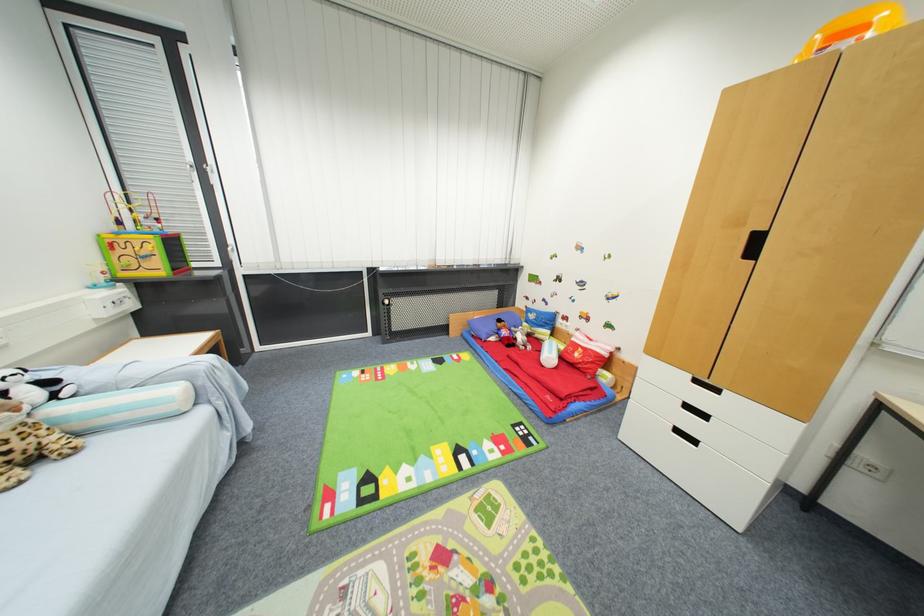
At what (x,y) coordinates should I click in order to perform the action: click on orange toy vehicle. Please return your answer as a coordinate pair (x, y). Looking at the image, I should click on (854, 28).